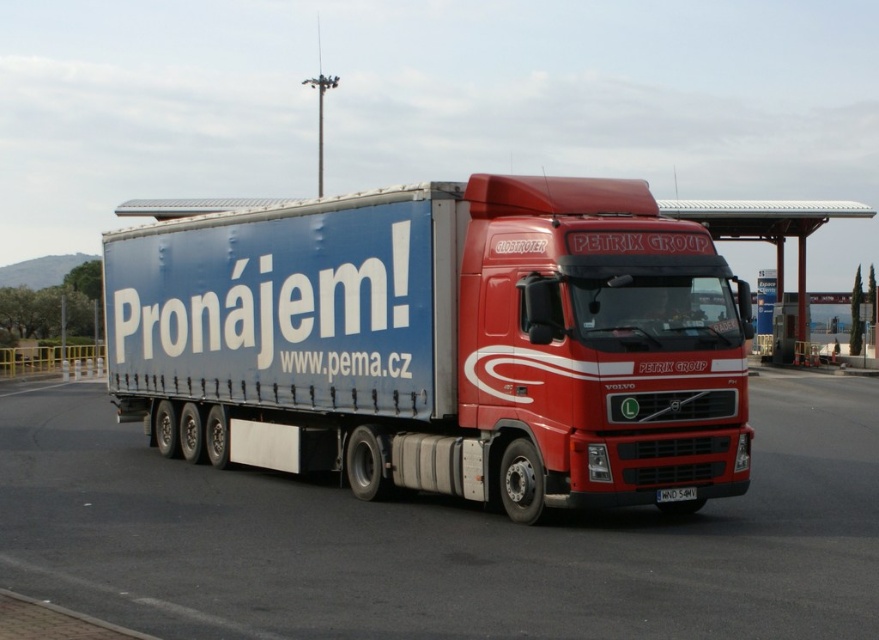
You are standing at the point marked by the coordinates point (x=441, y=342). Looking around, you see the matte blue trailer at center. What object is located exactly at your current position?

The point (x=441, y=342) indicates the location of the matte blue trailer at center.

You are a delivery driver who needs to park your truck exactly at the coordinates given in the image. What are the coordinates where the red matte truck at center is parked?

The red matte truck at center is parked at coordinates point (440, 540).

You are a delivery driver who needs to check the license plate of the red matte truck at center before starting your route. Where should you look relative to the truck to find the white plastic license plate at bottom center?

The white plastic license plate at bottom center is located above the red matte truck at center, so you should look upwards from the truck to find the license plate.